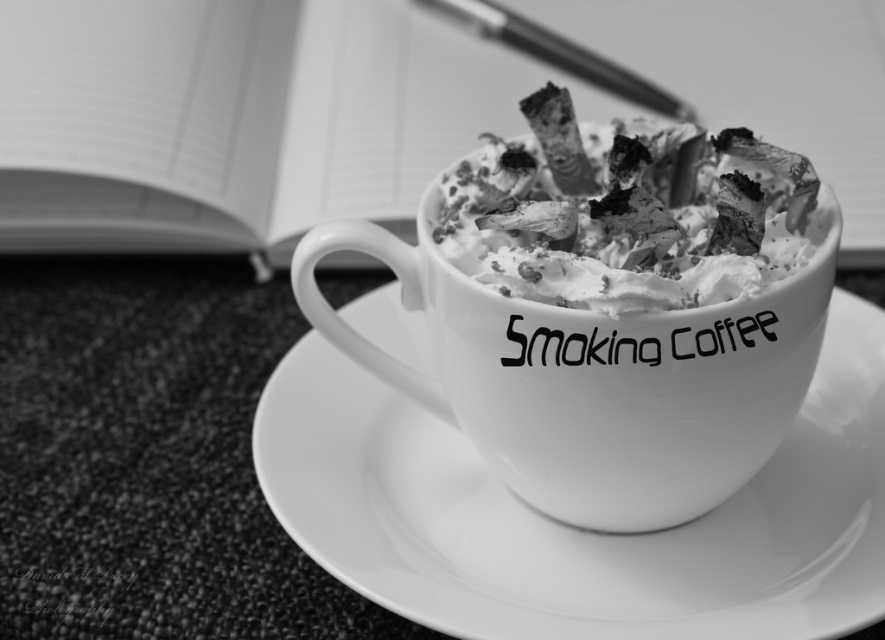
Who is higher up, white matte mug at center or metallic silver pen at upper center?

Positioned higher is metallic silver pen at upper center.

What do you see at coordinates (609, 308) in the screenshot? The width and height of the screenshot is (885, 640). I see `white matte mug at center` at bounding box center [609, 308].

Does point (453, 336) come behind point (630, 81)?

No, it is not.

Image resolution: width=885 pixels, height=640 pixels. What are the coordinates of `white matte mug at center` in the screenshot? It's located at (609, 308).

Who is more forward, (x=570, y=284) or (x=562, y=36)?

Point (x=570, y=284)

Who is positioned more to the left, charcoal-like ash at center or metallic silver pen at upper center?

charcoal-like ash at center is more to the left.

The width and height of the screenshot is (885, 640). What do you see at coordinates (627, 212) in the screenshot? I see `charcoal-like ash at center` at bounding box center [627, 212].

You are a GUI agent. You are given a task and a screenshot of the screen. Output one action in this format:
    pyautogui.click(x=<x>, y=<y>)
    Task: Click on the charcoal-like ash at center
    This screenshot has width=885, height=640.
    Given the screenshot: What is the action you would take?
    pyautogui.click(x=627, y=212)

Between white matte mug at center and charcoal-like ash at center, which one is positioned lower?

white matte mug at center is below.

Is white matte mug at center behind charcoal-like ash at center?

Yes, it is.

Who is more distant from viewer, (537, 161) or (664, 216)?

Point (537, 161)

Identify the location of white matte mug at center. The width and height of the screenshot is (885, 640). (609, 308).